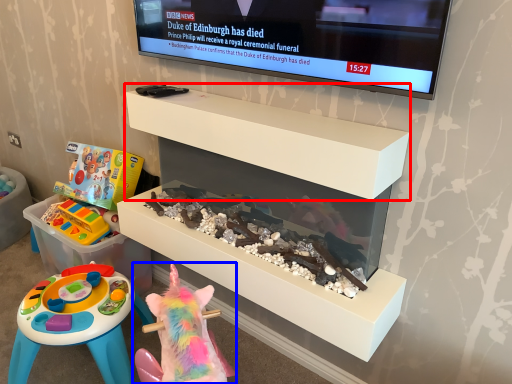
Question: Which object appears closest to the camera in this image, shelf (highlighted by a red box) or toy (highlighted by a blue box)?

Choices:
 (A) shelf
 (B) toy

Answer: (B)